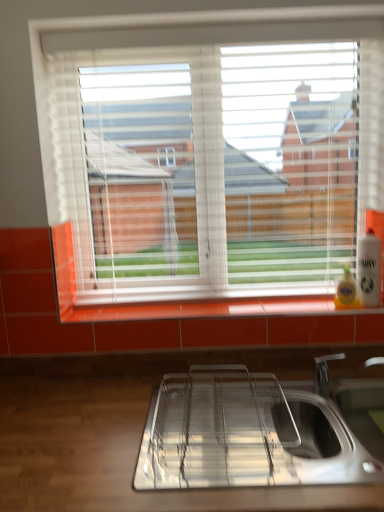
Question: Does white plastic blinds at upper center appear on the left side of white plastic bottle at right?

Choices:
 (A) yes
 (B) no

Answer: (A)

Question: From a real-world perspective, is white plastic blinds at upper center below white plastic bottle at right?

Choices:
 (A) no
 (B) yes

Answer: (A)

Question: Is white plastic bottle at right a part of white plastic blinds at upper center?

Choices:
 (A) no
 (B) yes

Answer: (A)

Question: Considering the relative sizes of white plastic blinds at upper center and white plastic bottle at right in the image provided, is white plastic blinds at upper center smaller than white plastic bottle at right?

Choices:
 (A) no
 (B) yes

Answer: (A)

Question: From the image's perspective, is white plastic blinds at upper center over white plastic bottle at right?

Choices:
 (A) no
 (B) yes

Answer: (B)

Question: Considering the relative sizes of white plastic blinds at upper center and white plastic bottle at right in the image provided, is white plastic blinds at upper center bigger than white plastic bottle at right?

Choices:
 (A) no
 (B) yes

Answer: (B)

Question: Does polished stainless steel sink at lower center appear on the right side of white plastic blinds at upper center?

Choices:
 (A) no
 (B) yes

Answer: (B)

Question: Is white plastic blinds at upper center located within polished stainless steel sink at lower center?

Choices:
 (A) yes
 (B) no

Answer: (B)

Question: From a real-world perspective, does polished stainless steel sink at lower center sit lower than white plastic blinds at upper center?

Choices:
 (A) no
 (B) yes

Answer: (B)

Question: Is polished stainless steel sink at lower center looking in the opposite direction of white plastic blinds at upper center?

Choices:
 (A) no
 (B) yes

Answer: (A)

Question: Is polished stainless steel sink at lower center further to the viewer compared to white plastic blinds at upper center?

Choices:
 (A) no
 (B) yes

Answer: (A)

Question: Is polished stainless steel sink at lower center beside white plastic blinds at upper center?

Choices:
 (A) yes
 (B) no

Answer: (B)

Question: From a real-world perspective, is white plastic bottle at right physically above white plastic blinds at upper center?

Choices:
 (A) no
 (B) yes

Answer: (A)